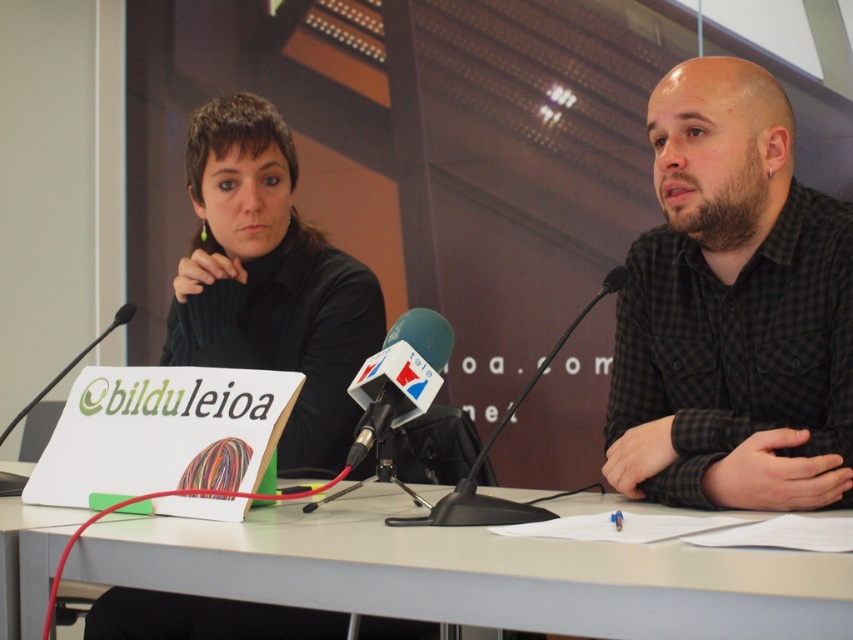
Question: Which point is closer to the camera taking this photo?

Choices:
 (A) (274, 636)
 (B) (15, 420)

Answer: (A)

Question: Can you confirm if black plastic microphone at center is smaller than matte black microphone at center?

Choices:
 (A) yes
 (B) no

Answer: (A)

Question: Can you confirm if black matte sweater at left is positioned below matte black microphone at center?

Choices:
 (A) yes
 (B) no

Answer: (B)

Question: Among these points, which one is farthest from the camera?

Choices:
 (A) (781, 134)
 (B) (827, 632)
 (C) (543, 518)

Answer: (A)

Question: Which object is farther from the camera taking this photo?

Choices:
 (A) black plastic microphone at center
 (B) black matte sweater at left
 (C) black checkered shirt at right

Answer: (B)

Question: Can you confirm if black matte sweater at left is positioned below matte black microphone at center?

Choices:
 (A) no
 (B) yes

Answer: (A)